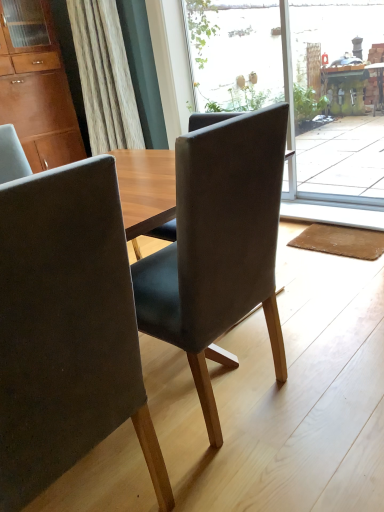
Question: From the image's perspective, is suede-like gray chair at center, the 2th chair positioned from the left, on top of matte brown cabinet at upper left?

Choices:
 (A) no
 (B) yes

Answer: (A)

Question: Does suede-like gray chair at center, positioned as the 1th chair in right-to-left order, have a lesser height compared to matte brown cabinet at upper left?

Choices:
 (A) no
 (B) yes

Answer: (B)

Question: Is suede-like gray chair at center, positioned as the 1th chair in right-to-left order, at the right side of matte brown cabinet at upper left?

Choices:
 (A) yes
 (B) no

Answer: (A)

Question: From a real-world perspective, is suede-like gray chair at center, positioned as the 1th chair in right-to-left order, below matte brown cabinet at upper left?

Choices:
 (A) yes
 (B) no

Answer: (A)

Question: From the image's perspective, does suede-like gray chair at center, the 2th chair positioned from the left, appear lower than matte brown cabinet at upper left?

Choices:
 (A) no
 (B) yes

Answer: (B)

Question: Can you confirm if suede-like gray chair at center, positioned as the 1th chair in right-to-left order, is positioned to the left of matte brown cabinet at upper left?

Choices:
 (A) no
 (B) yes

Answer: (A)

Question: Is brown fabric mat at lower right beside matte brown cabinet at upper left?

Choices:
 (A) yes
 (B) no

Answer: (B)

Question: From the image's perspective, is brown fabric mat at lower right on matte brown cabinet at upper left?

Choices:
 (A) no
 (B) yes

Answer: (A)

Question: Does brown fabric mat at lower right appear on the right side of matte brown cabinet at upper left?

Choices:
 (A) no
 (B) yes

Answer: (B)

Question: Would you consider brown fabric mat at lower right to be distant from matte brown cabinet at upper left?

Choices:
 (A) yes
 (B) no

Answer: (A)

Question: Is brown fabric mat at lower right behind matte brown cabinet at upper left?

Choices:
 (A) yes
 (B) no

Answer: (B)

Question: From a real-world perspective, is brown fabric mat at lower right over matte brown cabinet at upper left?

Choices:
 (A) yes
 (B) no

Answer: (B)

Question: Is transparent glass screen door at upper right at the left side of transparent glass door at center?

Choices:
 (A) no
 (B) yes

Answer: (A)